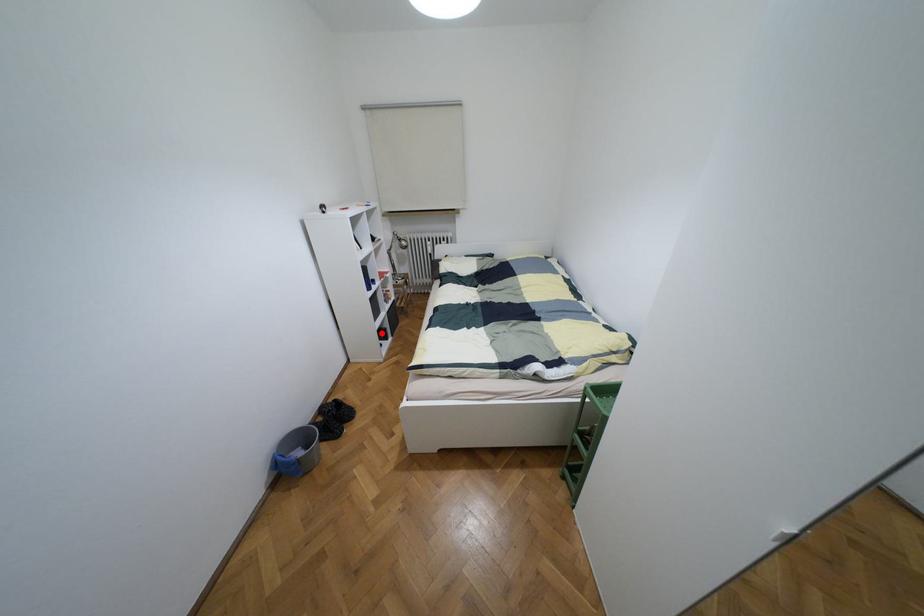
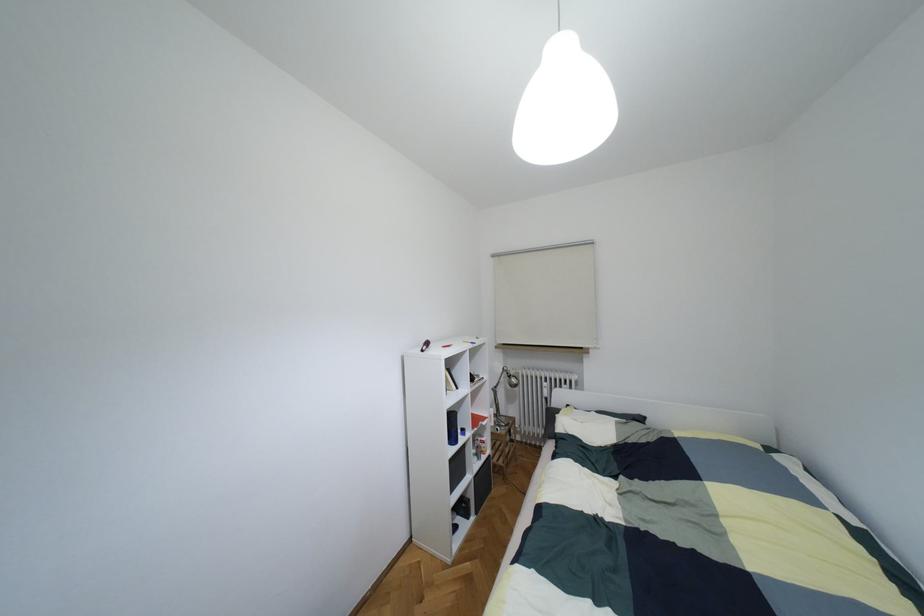
Find the pixel in the second image that matches the highlighted location in the first image.

(460, 508)